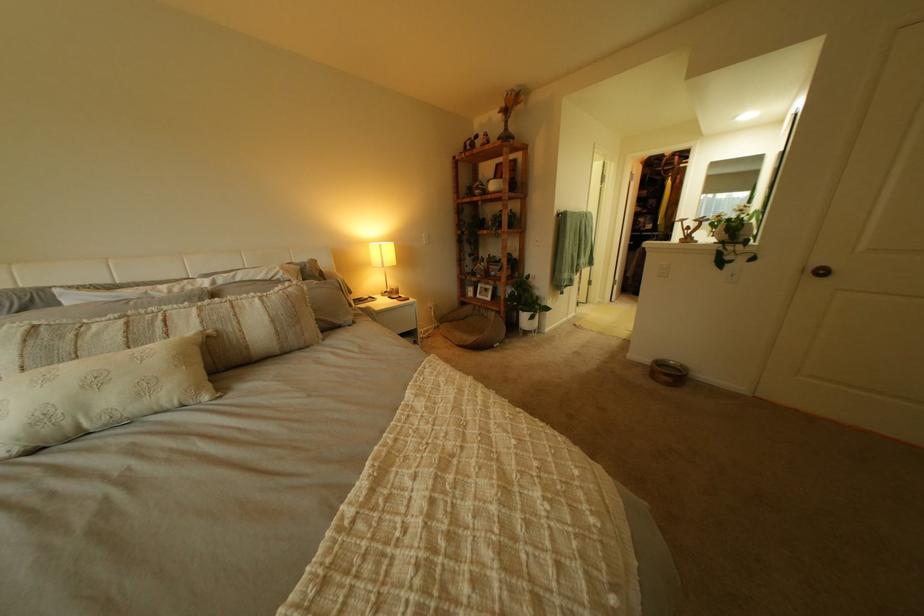
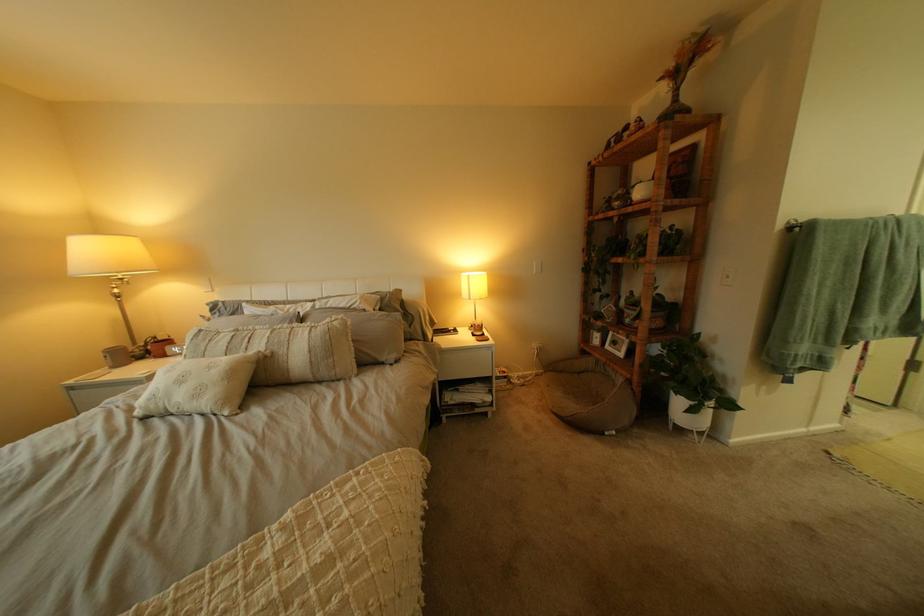
In the second image, find the point that corresponds to point (493, 297) in the first image.

(623, 347)